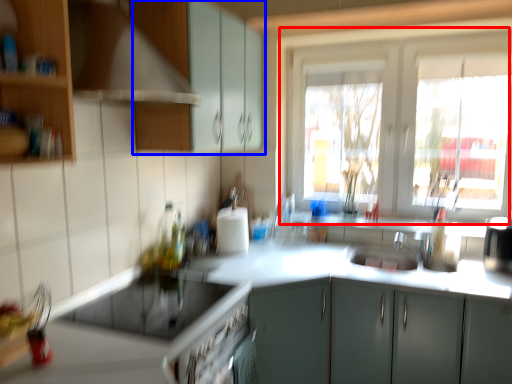
Question: Among these objects, which one is nearest to the camera, window (highlighted by a red box) or cabinetry (highlighted by a blue box)?

Choices:
 (A) window
 (B) cabinetry

Answer: (B)